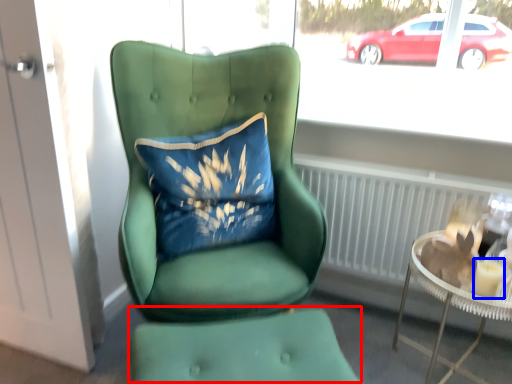
Question: Which of the following is the farthest to the observer, footrest (highlighted by a red box) or candle holder (highlighted by a blue box)?

Choices:
 (A) footrest
 (B) candle holder

Answer: (B)